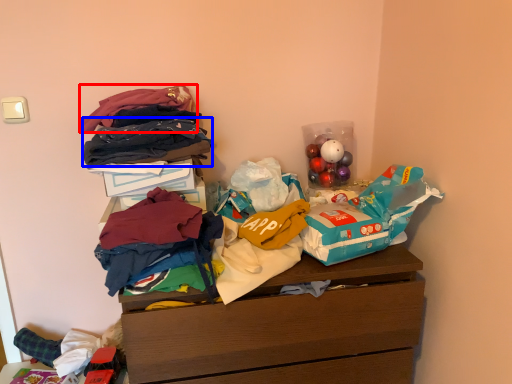
Question: Which point is closer to the camera, clothing (highlighted by a red box) or clothing (highlighted by a blue box)?

Choices:
 (A) clothing
 (B) clothing

Answer: (B)